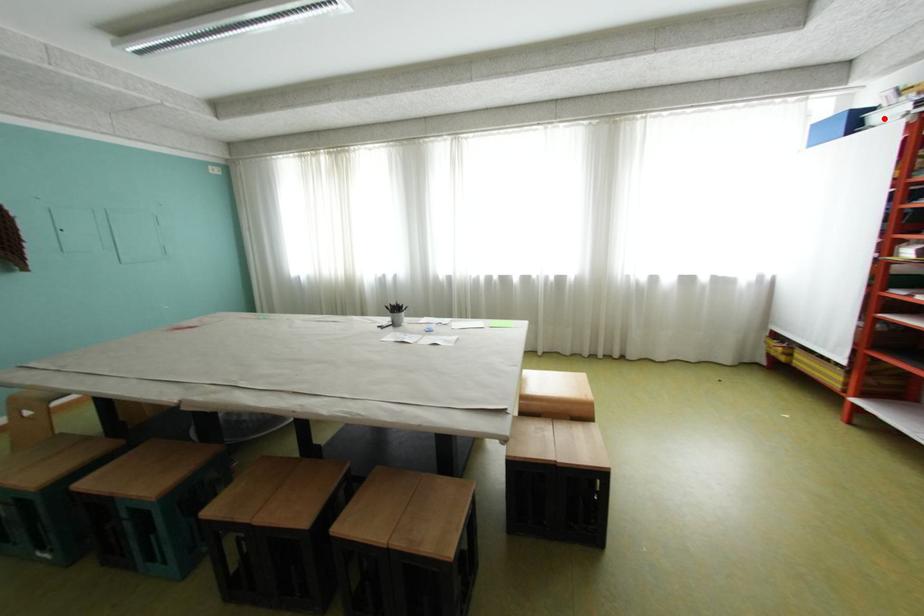
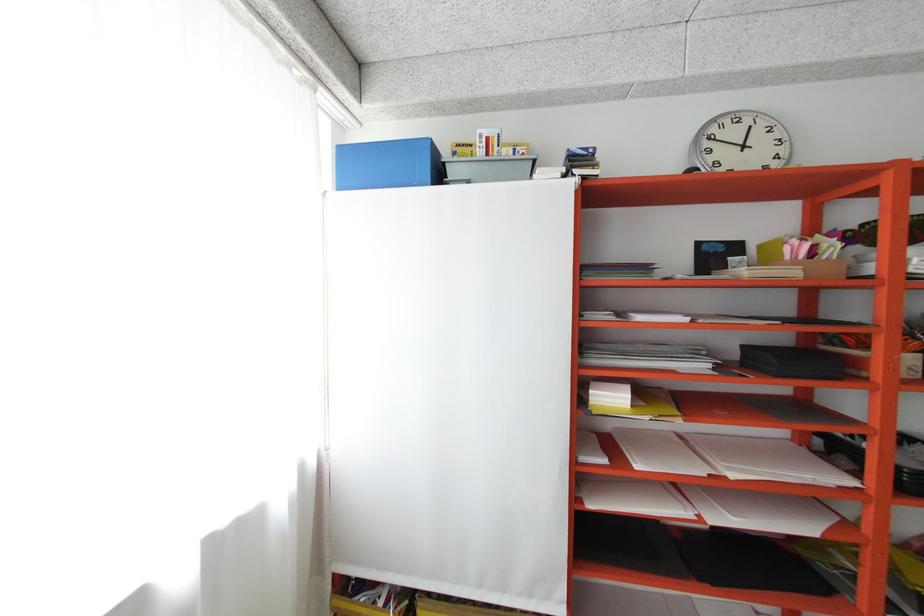
The point at the highlighted location is marked in the first image. Where is the corresponding point in the second image?

(460, 172)